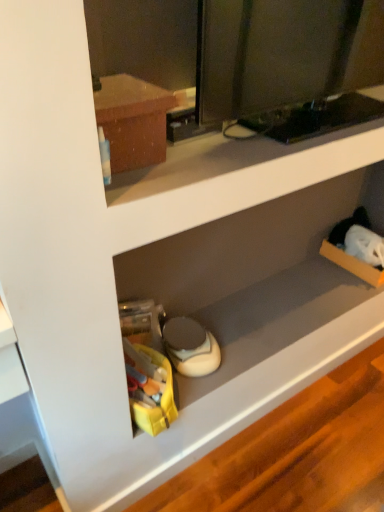
Identify the location of blank space above white matte speaker at lower center (from a real-world perspective). Image resolution: width=384 pixels, height=512 pixels. (270, 311).